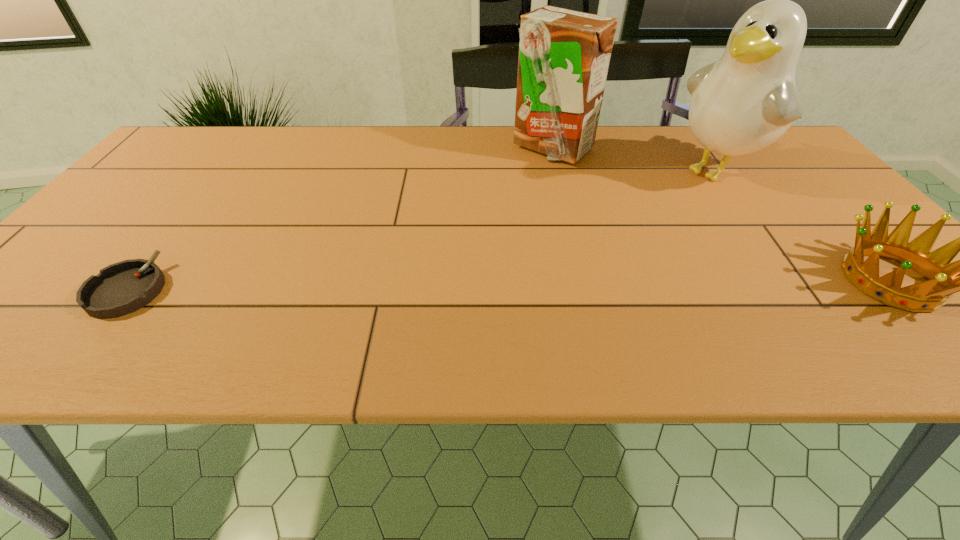
This screenshot has height=540, width=960. Find the location of `vacant space at the near edge of the desktop`. vacant space at the near edge of the desktop is located at coordinates (664, 292).

At what (x,y) coordinates should I click in order to perform the action: click on vacant area at the left edge of the desktop. Please return your answer as a coordinate pair (x, y). Looking at the image, I should click on (156, 181).

The width and height of the screenshot is (960, 540). I want to click on free space at the right edge of the desktop, so click(x=792, y=213).

Find the location of a particular element. The height and width of the screenshot is (540, 960). vacant space at the far left corner of the desktop is located at coordinates (214, 125).

Where is `vacant area that lies between the third shortest object and the leftmost object`? This screenshot has width=960, height=540. vacant area that lies between the third shortest object and the leftmost object is located at coordinates (340, 219).

Where is `free space that is in between the leftmost object and the tallest object`? free space that is in between the leftmost object and the tallest object is located at coordinates (423, 230).

Identify the location of empty space between the ashtray and the gull. (423, 230).

At what (x,y) coordinates should I click in order to perform the action: click on vacant space in between the tallest object and the ashtray. Please return your answer as a coordinate pair (x, y). Looking at the image, I should click on (423, 230).

This screenshot has height=540, width=960. What are the coordinates of `free space between the third object from right to left and the gull` in the screenshot? It's located at (636, 160).

You are a GUI agent. You are given a task and a screenshot of the screen. Output one action in this format:
    pyautogui.click(x=<x>, y=<y>)
    Task: Click on the free space between the gull and the third object from right to left
    The width and height of the screenshot is (960, 540).
    Given the screenshot: What is the action you would take?
    pyautogui.click(x=636, y=160)